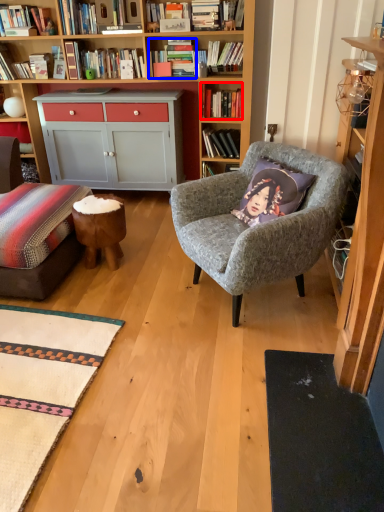
Question: Among these objects, which one is farthest to the camera, book (highlighted by a red box) or book (highlighted by a blue box)?

Choices:
 (A) book
 (B) book

Answer: (A)